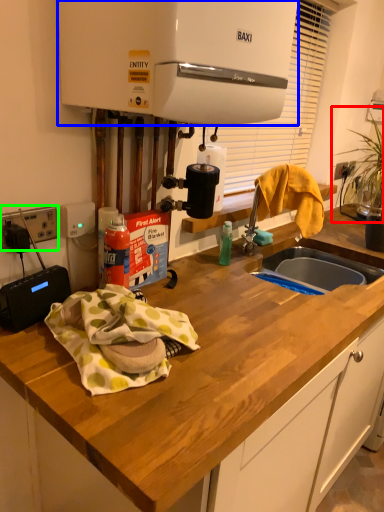
Question: Estimate the real-world distances between objects in this image. Which object is farther from plant (highlighted by a red box), home appliance (highlighted by a blue box) or electric outlet (highlighted by a green box)?

Choices:
 (A) home appliance
 (B) electric outlet

Answer: (B)